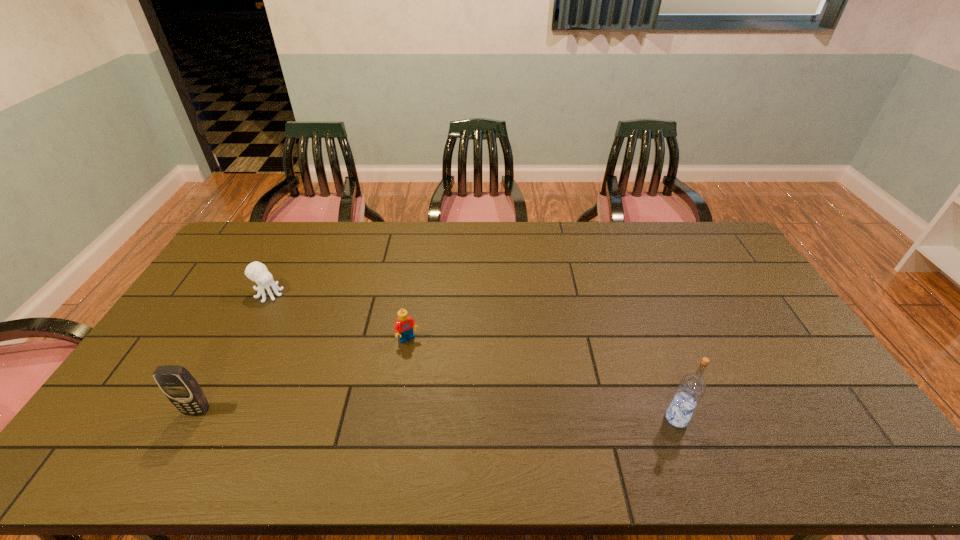
In order to click on vacant space that is in between the third shortest object and the rightmost object in this screenshot , I will do `click(437, 414)`.

Where is `vacant region between the octopus and the third object from left to right`? Image resolution: width=960 pixels, height=540 pixels. vacant region between the octopus and the third object from left to right is located at coordinates (339, 317).

Choose which object is the second nearest neighbor to the octopus. Please provide its 2D coordinates. Your answer should be formatted as a tuple, i.e. [(x, y)], where the tuple contains the x and y coordinates of a point satisfying the conditions above.

[(403, 327)]

You are a GUI agent. You are given a task and a screenshot of the screen. Output one action in this format:
    pyautogui.click(x=<x>, y=<y>)
    Task: Click on the object that stands as the third closest to the vodka
    The width and height of the screenshot is (960, 540).
    Given the screenshot: What is the action you would take?
    coord(255,271)

At what (x,y) coordinates should I click in order to perform the action: click on vacant space that satisfies the following two spatial constraints: 1. on the front side of the third nearest object; 2. on the right side of the vodka. Please return your answer as a coordinate pair (x, y). The image size is (960, 540). Looking at the image, I should click on click(x=396, y=418).